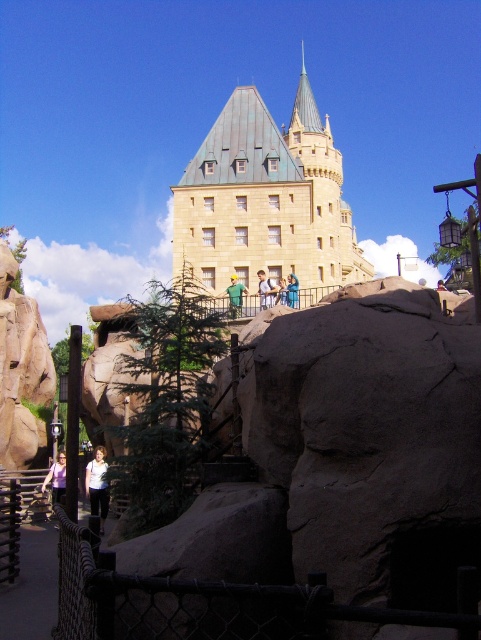
Question: Among these points, which one is farthest from the camera?

Choices:
 (A) (294, 300)
 (B) (49, 476)
 (C) (228, 289)
 (D) (268, 292)

Answer: (C)

Question: Estimate the real-world distances between objects in this image. Which object is farther from the green fabric shirt at center?

Choices:
 (A) light purple shirt at lower left
 (B) light blue denim jacket at center
 (C) blue denim jeans at center

Answer: (A)

Question: Does stone tower at center have a smaller size compared to light purple shirt at lower left?

Choices:
 (A) yes
 (B) no

Answer: (B)

Question: Is stone tower at center positioned at the back of green fabric shirt at center?

Choices:
 (A) no
 (B) yes

Answer: (B)

Question: Which point is closer to the camera taking this photo?

Choices:
 (A) (48, 481)
 (B) (354, 266)

Answer: (A)

Question: Does stone tower at center appear over white matte shirt at lower left?

Choices:
 (A) no
 (B) yes

Answer: (B)